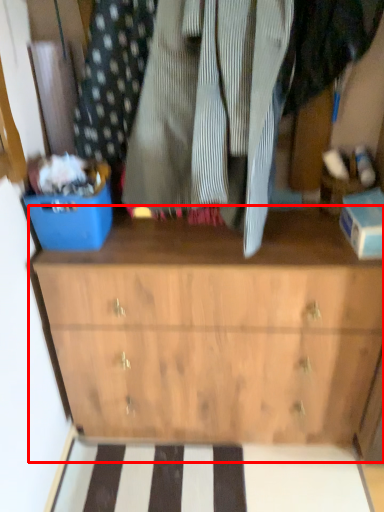
Question: From the image's perspective, where is chest of drawers (annotated by the red box) located in relation to storage box in the image?

Choices:
 (A) below
 (B) above

Answer: (A)